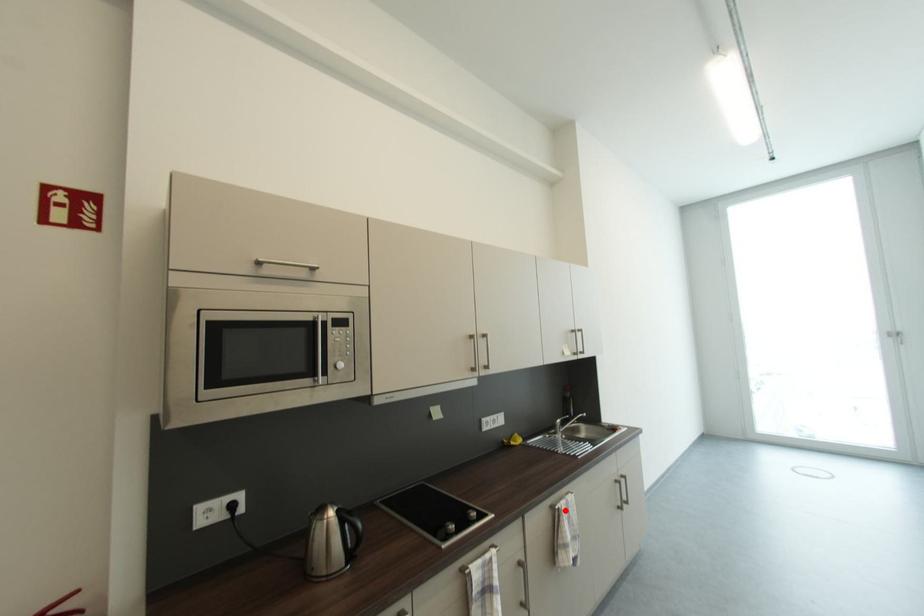
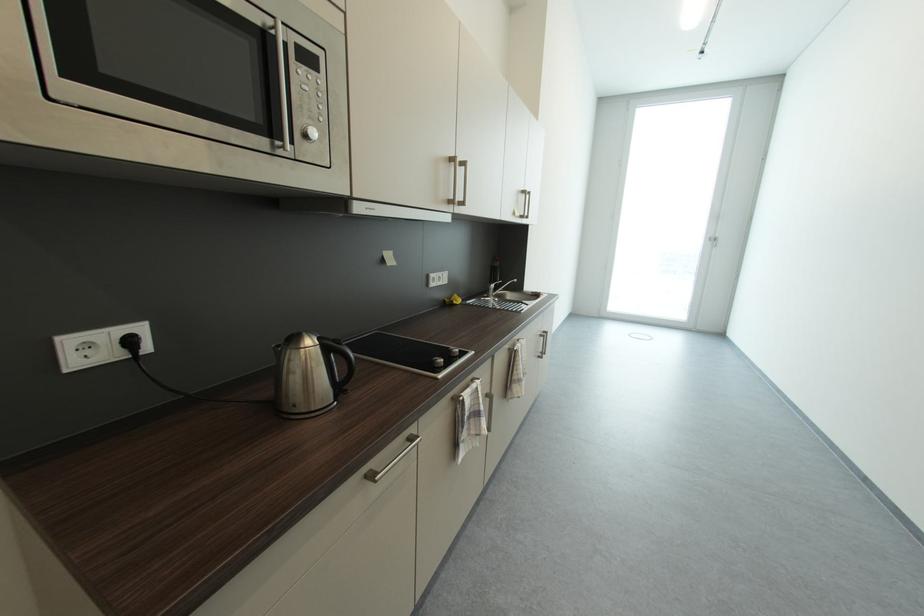
The point at the highlighted location is marked in the first image. Where is the corresponding point in the second image?

(523, 351)